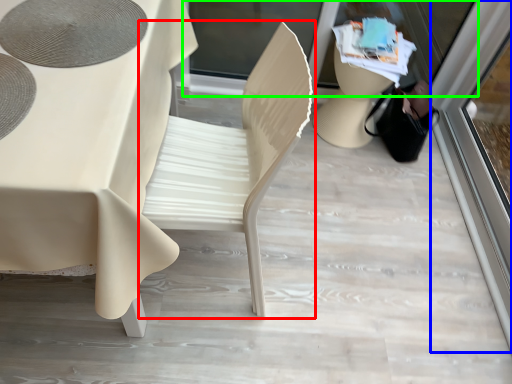
Question: Which is farther away from chair (highlighted by a red box)? screen door (highlighted by a blue box) or shop window (highlighted by a green box)?

Choices:
 (A) screen door
 (B) shop window

Answer: (A)